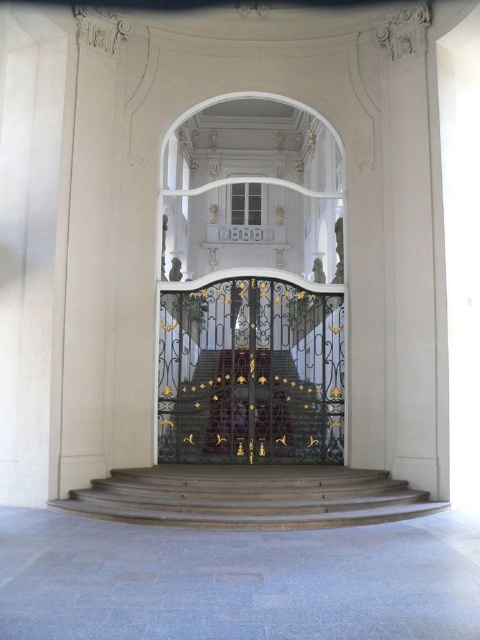
You are standing in the grand hall and want to walk towards the staircase behind the gates. There are two points marked on the gates, one at point (176, 241) and the other at point (311, 488). Which point is closer to you as you face the gates?

Point (176, 241) is closer to you because it is further to the viewer than point (311, 488).

You are standing in the grand hall and want to take a photo of the ornate black wrought iron gates with gold accents. You notice two points marked on the gates at coordinates point (243, 492) and point (205, 449). Which point is closer to your camera when taking the photo?

Point (243, 492) is closer to the camera than point (205, 449).